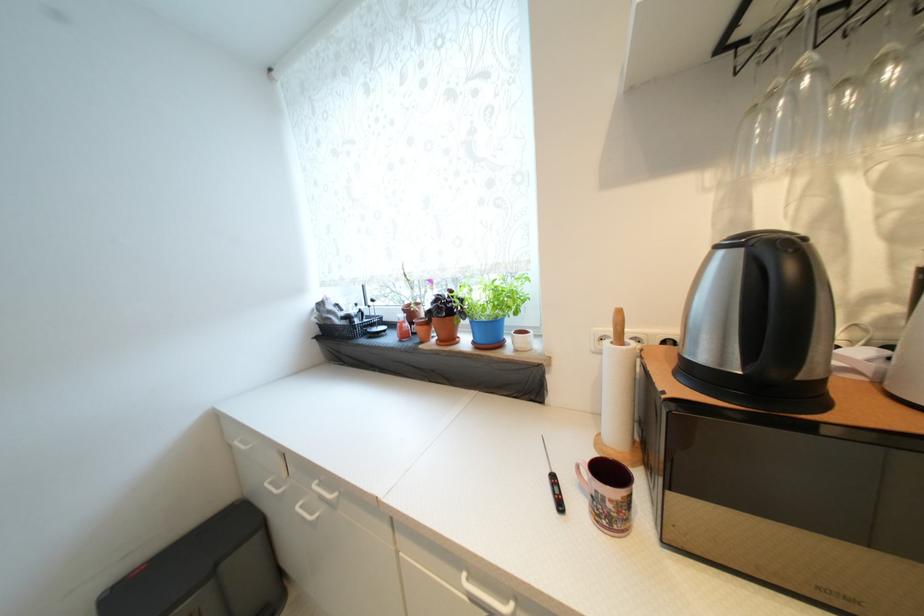
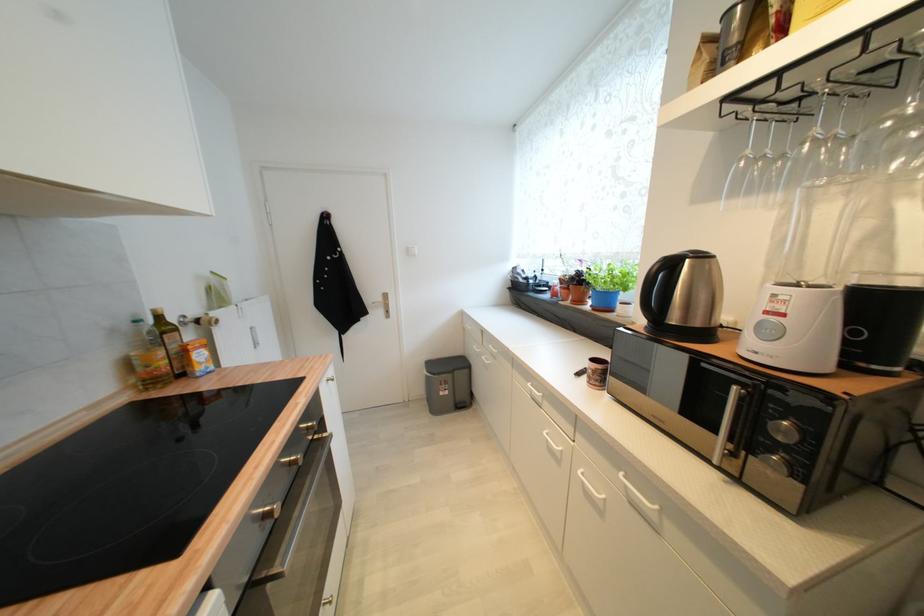
Question: The first image is from the beginning of the video and the second image is from the end. How did the camera likely rotate when shooting the video?

Choices:
 (A) Left
 (B) Right
 (C) Up
 (D) Down

Answer: (A)